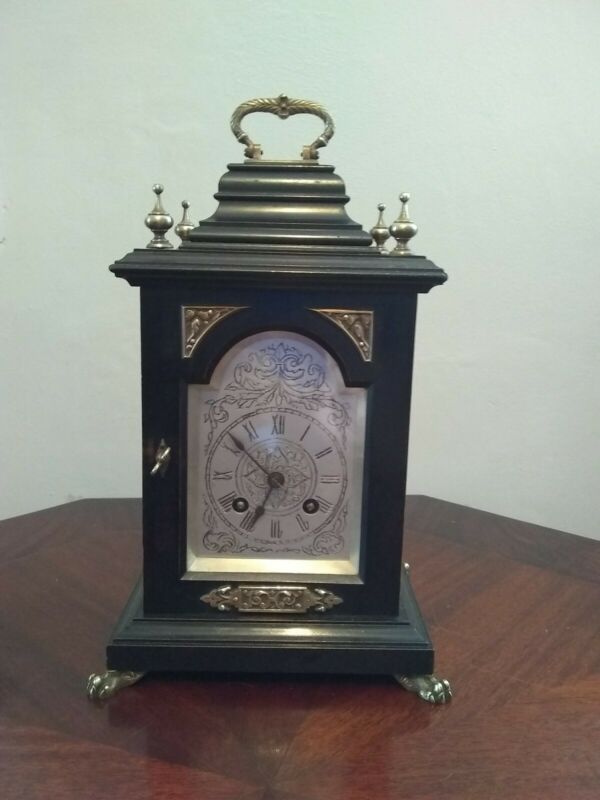
Where is `ornaments`? The height and width of the screenshot is (800, 600). ornaments is located at coordinates (269, 597), (198, 320), (358, 322).